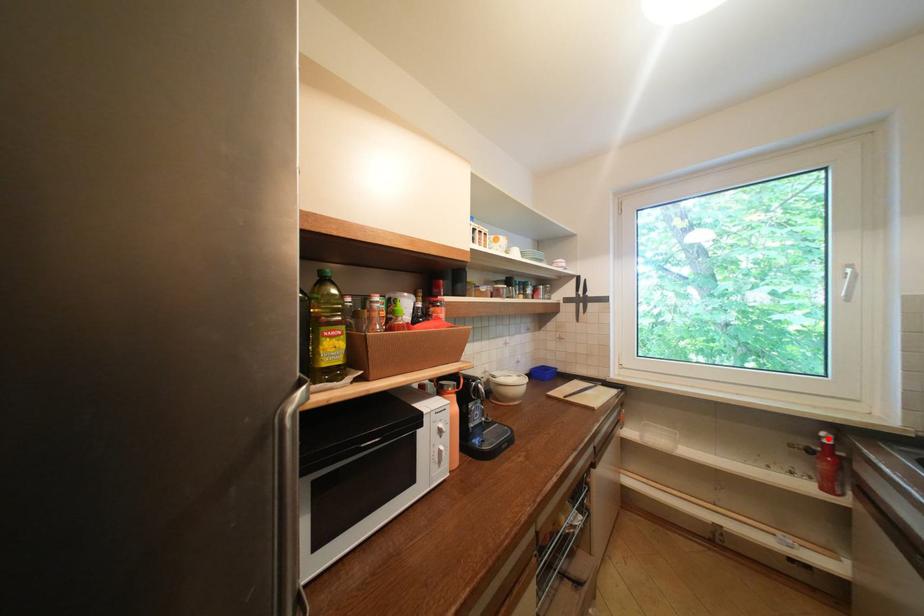
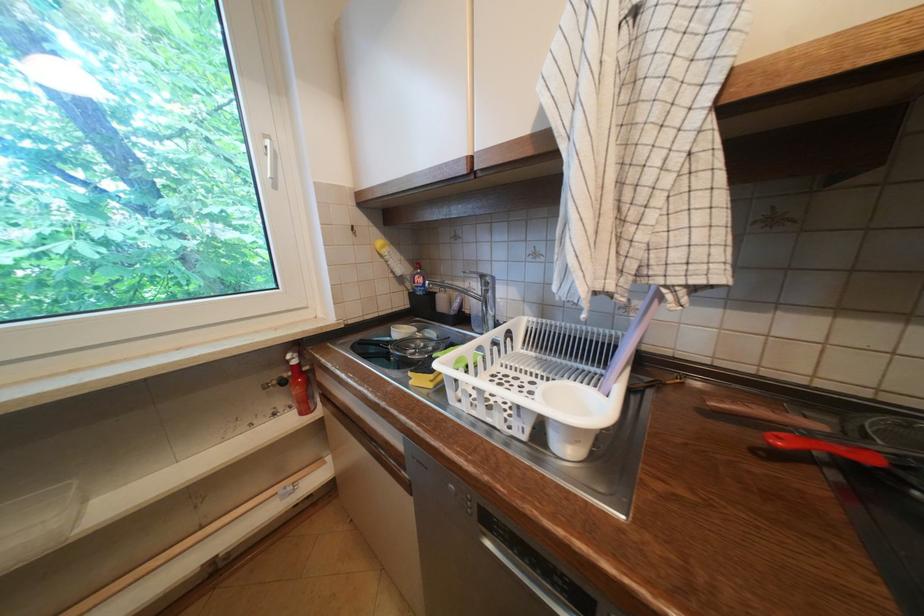
Where in the second image is the point corresponding to the highlighted location from the first image?

(296, 362)